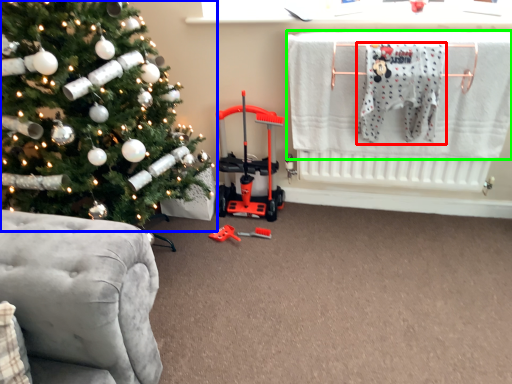
Question: Which object is positioned closest to baby clothe (highlighted by a red box)? Select from christmas tree (highlighted by a blue box) and laundry (highlighted by a green box).

Choices:
 (A) christmas tree
 (B) laundry

Answer: (B)